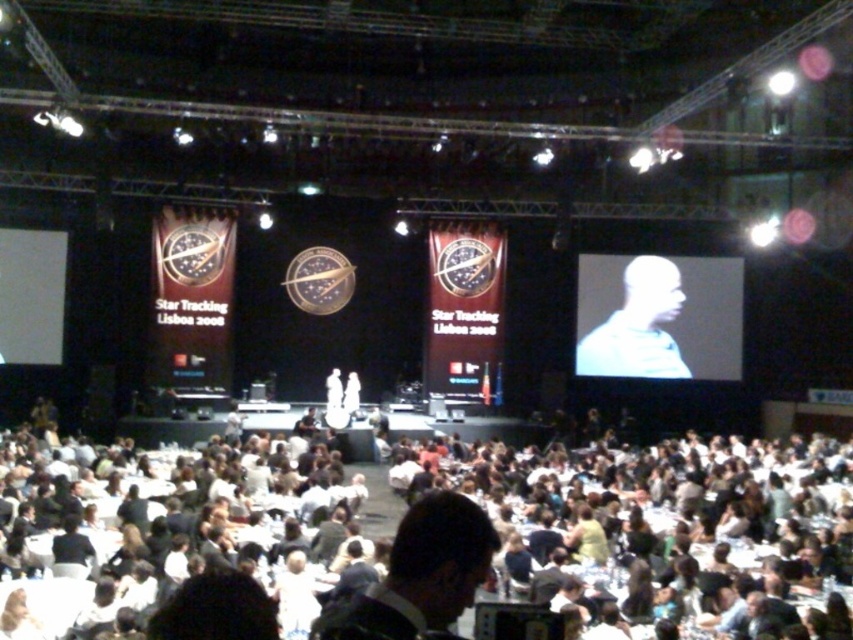
Does white cloth-covered tables at lower center lie behind dark brown hair at center?

Yes.

Between point (0, 481) and point (445, 611), which one is positioned in front?

Point (445, 611) is more forward.

Identify the location of white cloth-covered tables at lower center. Image resolution: width=853 pixels, height=640 pixels. (656, 536).

Who is positioned more to the left, white matte screen at upper right or dark brown hair at center?

dark brown hair at center is more to the left.

Can you confirm if white matte screen at upper right is positioned to the right of dark brown hair at center?

Indeed, white matte screen at upper right is positioned on the right side of dark brown hair at center.

Is point (730, 280) behind point (474, 580)?

Yes.

You are a GUI agent. You are given a task and a screenshot of the screen. Output one action in this format:
    pyautogui.click(x=<x>, y=<y>)
    Task: Click on the white matte screen at upper right
    Image resolution: width=853 pixels, height=640 pixels.
    Given the screenshot: What is the action you would take?
    pyautogui.click(x=659, y=316)

Which is above, dark brown hair at center or white matte projection screen at left?

white matte projection screen at left is higher up.

Who is more forward, (x=389, y=627) or (x=36, y=358)?

Point (x=389, y=627) is in front.

Does point (431, 624) lie in front of point (47, 253)?

Yes.

In order to click on dark brown hair at center in this screenshot , I will do `click(422, 573)`.